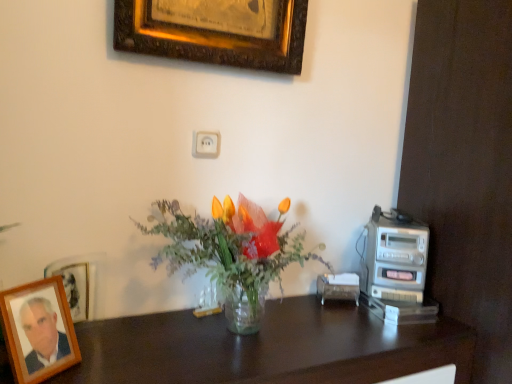
At what (x,y) coordinates should I click in order to perform the action: click on free space to the right of transparent glass vase at center. Please return your answer as a coordinate pair (x, y). Image resolution: width=512 pixels, height=384 pixels. Looking at the image, I should click on (352, 334).